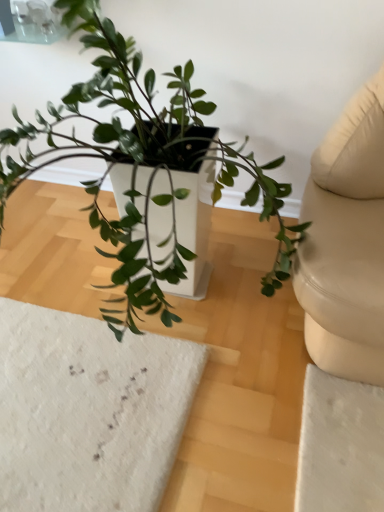
Locate an element on the screen. green matte plant at center is located at coordinates click(x=144, y=164).

In order to face green matte plant at center, should I rotate leftwards or rightwards?

Rotate left and turn 5.178 degrees.

This screenshot has width=384, height=512. Describe the element at coordinates (144, 164) in the screenshot. I see `green matte plant at center` at that location.

Where is `green matte plant at center`? This screenshot has height=512, width=384. green matte plant at center is located at coordinates (144, 164).